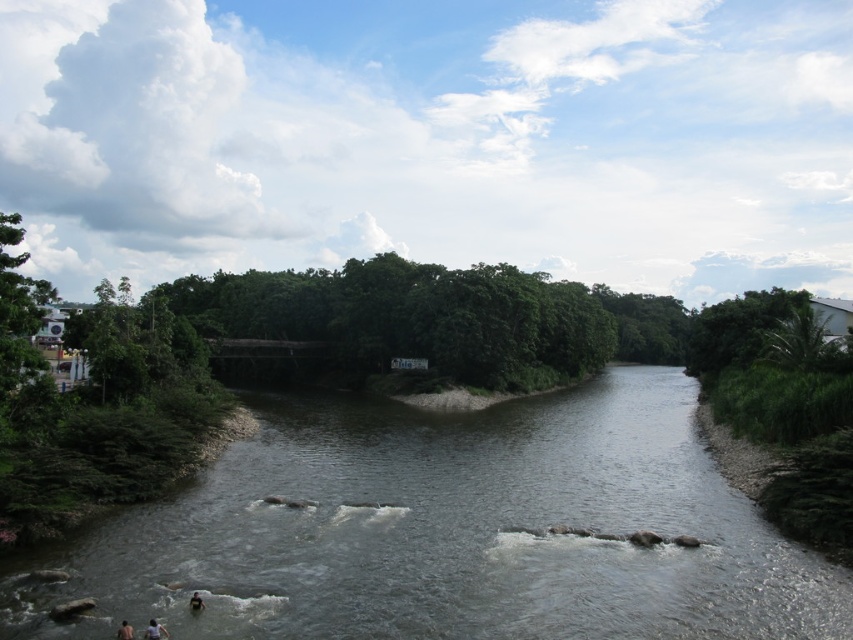
You are a tour guide leading a group to the gray smooth river at center. You want to ensure everyone can safely cross the river. The widest point of the river is 50 feet. Can the group cross the river safely?

The gray smooth river at center has a widest point of 50 feet. The group can cross safely as the distance between them is 49.98 feet, which is just under the maximum width.

You are a photographer planning to take a portrait of the dark skin human at center. To ensure the white cotton shirt at lower left doesn not distract, where should you position the shirt relative to the human?

The white cotton shirt at lower left is already positioned to the left of the dark skin human at center, so to avoid distraction, keep the shirt to the left side in the frame.